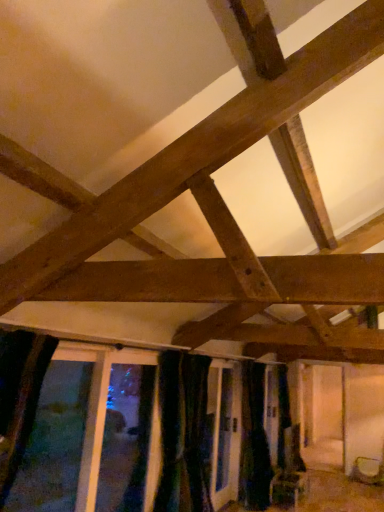
Question: Is transparent glass window at lower left looking in the opposite direction of black fabric curtain at lower center?

Choices:
 (A) no
 (B) yes

Answer: (A)

Question: Is black fabric curtain at lower center a part of transparent glass window at lower left?

Choices:
 (A) yes
 (B) no

Answer: (B)

Question: Can you confirm if transparent glass window at lower left is shorter than black fabric curtain at lower center?

Choices:
 (A) yes
 (B) no

Answer: (A)

Question: Considering the relative sizes of transparent glass window at lower left and black fabric curtain at lower center in the image provided, is transparent glass window at lower left thinner than black fabric curtain at lower center?

Choices:
 (A) yes
 (B) no

Answer: (B)

Question: Does transparent glass window at lower left have a greater height compared to black fabric curtain at lower center?

Choices:
 (A) no
 (B) yes

Answer: (A)

Question: Is transparent glass window at lower left wider than black fabric curtain at lower center?

Choices:
 (A) no
 (B) yes

Answer: (B)

Question: Considering the relative sizes of matte brown basket at lower right and transparent glass window at lower left in the image provided, is matte brown basket at lower right bigger than transparent glass window at lower left?

Choices:
 (A) yes
 (B) no

Answer: (B)

Question: Would you consider matte brown basket at lower right to be distant from transparent glass window at lower left?

Choices:
 (A) no
 (B) yes

Answer: (B)

Question: Is the position of matte brown basket at lower right more distant than that of transparent glass window at lower left?

Choices:
 (A) yes
 (B) no

Answer: (A)

Question: From the image's perspective, does matte brown basket at lower right appear lower than transparent glass window at lower left?

Choices:
 (A) no
 (B) yes

Answer: (B)

Question: Considering the relative positions of matte brown basket at lower right and transparent glass window at lower left in the image provided, is matte brown basket at lower right to the right of transparent glass window at lower left from the viewer's perspective?

Choices:
 (A) yes
 (B) no

Answer: (A)

Question: Does matte brown basket at lower right have a greater height compared to transparent glass window at lower left?

Choices:
 (A) yes
 (B) no

Answer: (B)

Question: Can you confirm if black fabric curtain at lower center is positioned to the left of matte brown basket at lower right?

Choices:
 (A) yes
 (B) no

Answer: (A)